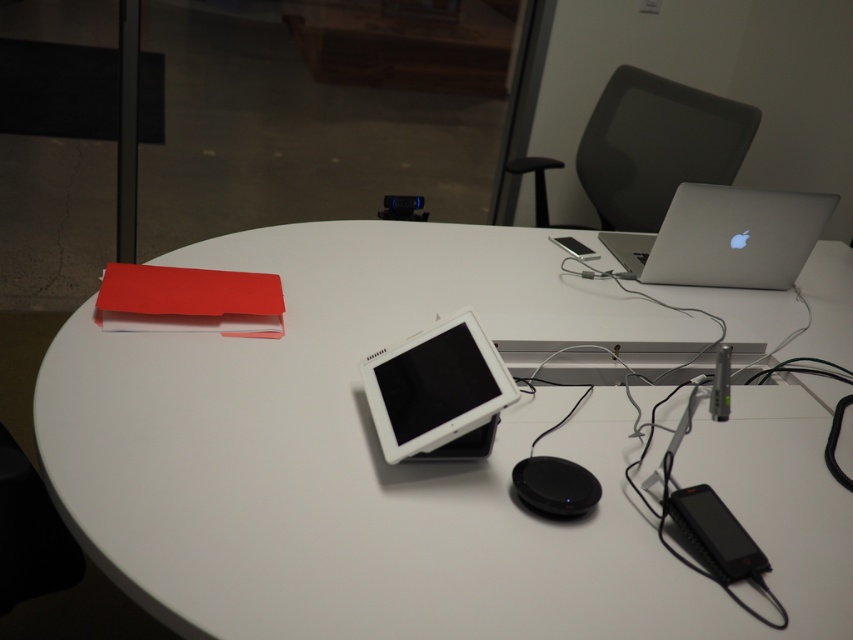
You are standing at the entrance of the office and see the white glossy table at upper left located at point (364, 451). If you walk straight towards the table, will you reach it before encountering any obstacles?

The white glossy table at upper left is located at point (364, 451), so walking straight towards it would lead you directly to the table without encountering obstacles first.

You are taking a photo of the office setup. You notice two points in the image at coordinates point (674, 214) and point (425, 438). Which point is closer to the camera?

Point (425, 438) is closer to the camera because it is less further than point (674, 214).

You are sitting at the white glossy table at upper left and want to reach the silver metallic laptop at upper right. Which direction should you move to get closer to the laptop?

Since the white glossy table at upper left is closer to the viewer than the silver metallic laptop at upper right, you should move forward towards the laptop to get closer.